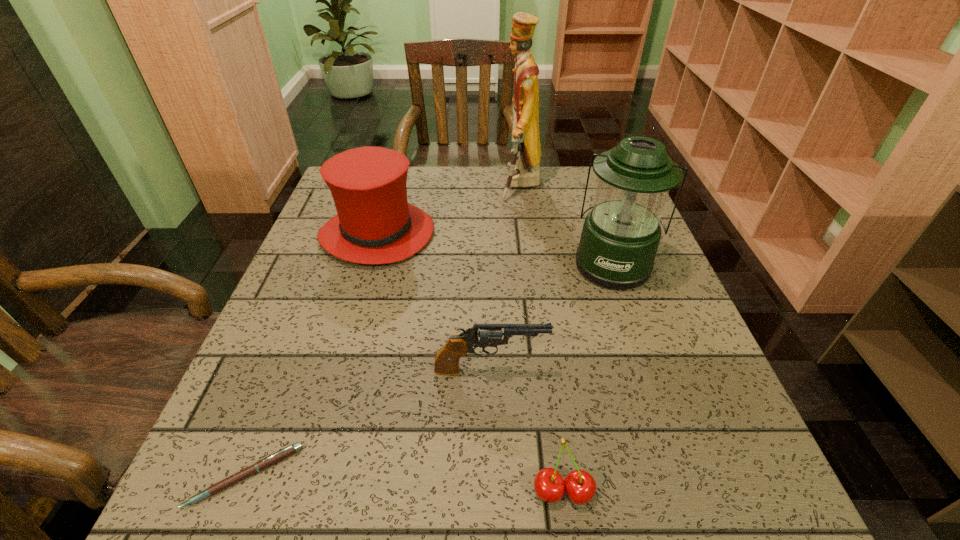
Locate an element on the screen. The height and width of the screenshot is (540, 960). object that is at the far left corner is located at coordinates (375, 224).

At what (x,y) coordinates should I click in order to perform the action: click on object that is at the near left corner. Please return your answer as a coordinate pair (x, y). Image resolution: width=960 pixels, height=540 pixels. Looking at the image, I should click on (268, 461).

Where is `vacant region at the far edge of the desktop`? The height and width of the screenshot is (540, 960). vacant region at the far edge of the desktop is located at coordinates (446, 200).

The height and width of the screenshot is (540, 960). In the image, there is a desktop. What are the coordinates of `free space at the near edge` in the screenshot? It's located at (312, 470).

Where is `vacant space at the left edge`? This screenshot has height=540, width=960. vacant space at the left edge is located at coordinates (303, 292).

Where is `vacant space at the right edge of the desktop`? The image size is (960, 540). vacant space at the right edge of the desktop is located at coordinates (686, 416).

Find the location of a particular element. This screenshot has height=540, width=960. free space at the far right corner of the desktop is located at coordinates (577, 211).

Find the location of a particular element. This screenshot has width=960, height=540. vacant space at the near right corner of the desktop is located at coordinates (704, 521).

At what (x,y) coordinates should I click in order to perform the action: click on vacant space that's between the hat and the third nearest object. Please return your answer as a coordinate pair (x, y). This screenshot has width=960, height=540. Looking at the image, I should click on (434, 302).

This screenshot has height=540, width=960. I want to click on vacant area between the tallest object and the third tallest object, so click(x=449, y=210).